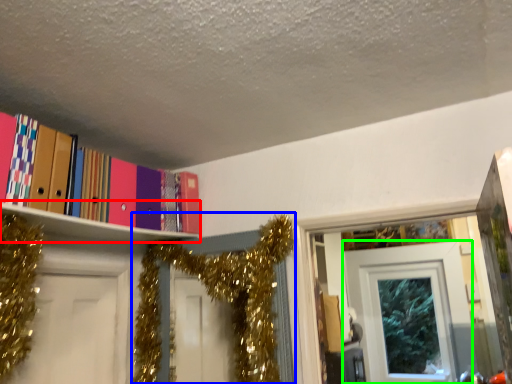
Question: Which is farther away from shelf (highlighted by a red box)? christmas decoration (highlighted by a blue box) or door (highlighted by a green box)?

Choices:
 (A) christmas decoration
 (B) door

Answer: (B)